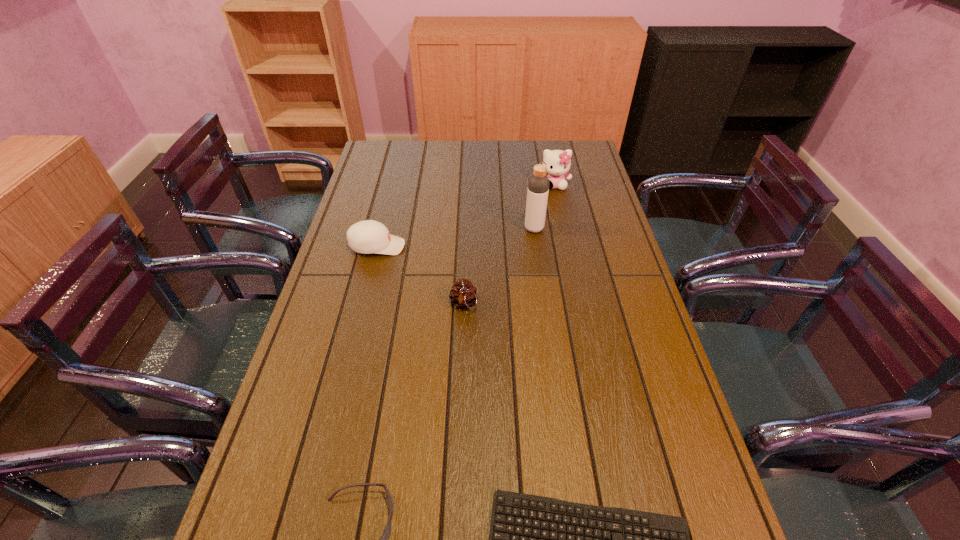
In order to click on object located in the left edge section of the desktop in this screenshot , I will do `click(369, 236)`.

Image resolution: width=960 pixels, height=540 pixels. In order to click on object located in the right edge section of the desktop in this screenshot , I will do `click(558, 162)`.

You are a GUI agent. You are given a task and a screenshot of the screen. Output one action in this format:
    pyautogui.click(x=<x>, y=<y>)
    Task: Click on the free spot at the far edge of the desktop
    
    Given the screenshot: What is the action you would take?
    pyautogui.click(x=413, y=141)

You are a GUI agent. You are given a task and a screenshot of the screen. Output one action in this format:
    pyautogui.click(x=<x>, y=<y>)
    Task: Click on the vacant space at the left edge
    This screenshot has width=960, height=540.
    Given the screenshot: What is the action you would take?
    pyautogui.click(x=346, y=239)

Where is `blank area at the right edge`? This screenshot has height=540, width=960. blank area at the right edge is located at coordinates tap(633, 348).

In the image, there is a desktop. What are the coordinates of `vacant area at the far right corner` in the screenshot? It's located at (578, 163).

Image resolution: width=960 pixels, height=540 pixels. Identify the location of vacant area that lies between the baseball cap and the tallest object. (456, 238).

You are a GUI agent. You are given a task and a screenshot of the screen. Output one action in this format:
    pyautogui.click(x=<x>, y=<y>)
    Task: Click on the vacant area between the baseball cap and the bottle
    The height and width of the screenshot is (540, 960).
    Given the screenshot: What is the action you would take?
    pyautogui.click(x=456, y=238)

Locate an element on the screen. The image size is (960, 540). the third closest object to the shortest object is located at coordinates (369, 236).

Locate an element on the screen. The width and height of the screenshot is (960, 540). object that ranks as the fourth closest to the fourth farthest object is located at coordinates (385, 536).